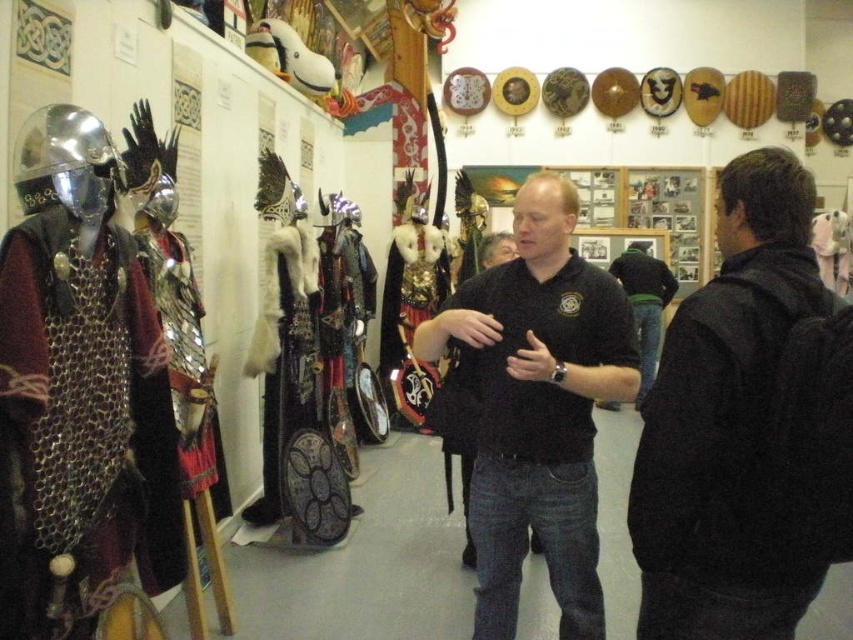
Is point (35, 609) behind point (451, 305)?

No, (35, 609) is in front of (451, 305).

Does chainmail armor at left appear on the right side of black matte polo shirt at center?

No, chainmail armor at left is not to the right of black matte polo shirt at center.

Locate an element on the screen. chainmail armor at left is located at coordinates click(79, 394).

Does dark gray fleece jacket at right appear on the right side of black matte shirt at center?

Yes, dark gray fleece jacket at right is to the right of black matte shirt at center.

Is dark gray fleece jacket at right thinner than black matte shirt at center?

Yes.

In order to click on dark gray fleece jacket at right in this screenshot , I will do `click(728, 424)`.

Is black matte shirt at center below black matte polo shirt at center?

Yes.

Does black matte shirt at center appear over black matte polo shirt at center?

No.

What do you see at coordinates (537, 406) in the screenshot?
I see `black matte shirt at center` at bounding box center [537, 406].

This screenshot has width=853, height=640. Find the location of `black matte shirt at center`. black matte shirt at center is located at coordinates (537, 406).